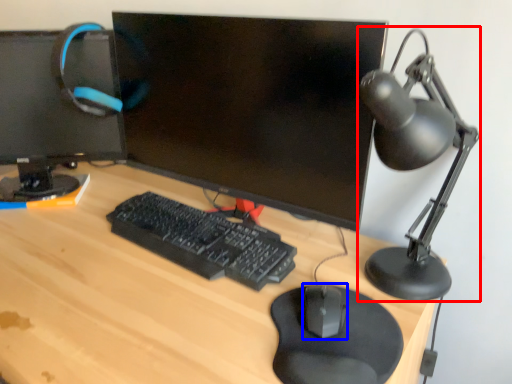
Question: Which object is further to the camera taking this photo, table lamp (highlighted by a red box) or mouse (highlighted by a blue box)?

Choices:
 (A) table lamp
 (B) mouse

Answer: (B)